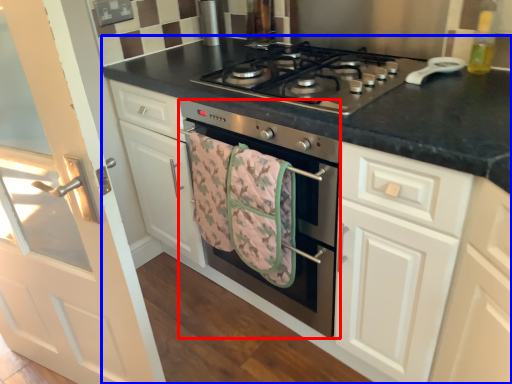
Question: Which object is closer to the camera taking this photo, oven (highlighted by a red box) or countertop (highlighted by a blue box)?

Choices:
 (A) oven
 (B) countertop

Answer: (B)